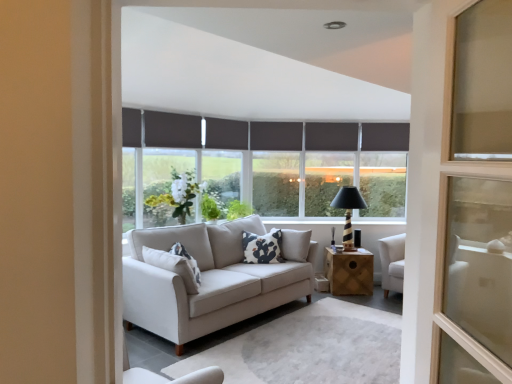
The height and width of the screenshot is (384, 512). What are the coordinates of `free space above dark grey fabric curtain at upper center, the first curtain in the front-to-back sequence (from a real-world perspective)` in the screenshot? It's located at (163, 109).